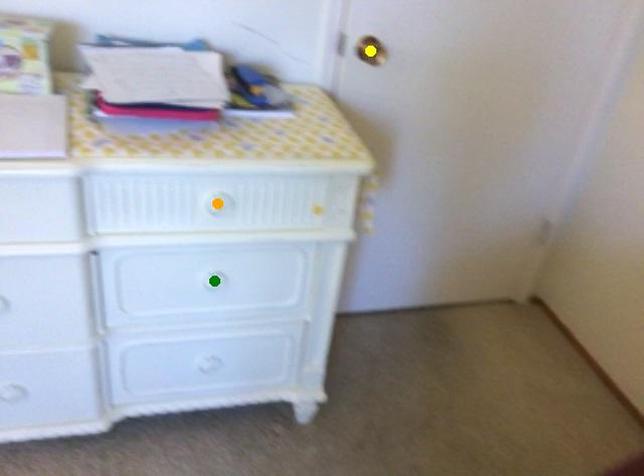
Order these from farthest to nearest:
1. orange point
2. green point
3. yellow point

yellow point → green point → orange point